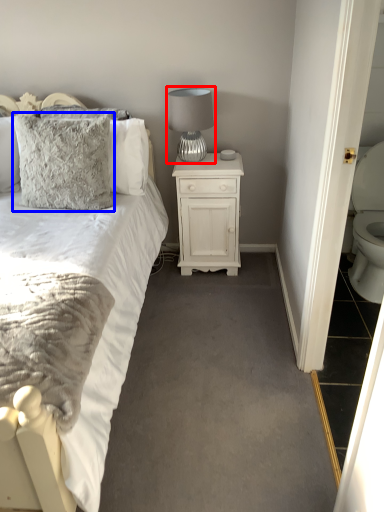
Question: Among these objects, which one is farthest to the camera, table lamp (highlighted by a red box) or pillow (highlighted by a blue box)?

Choices:
 (A) table lamp
 (B) pillow

Answer: (A)